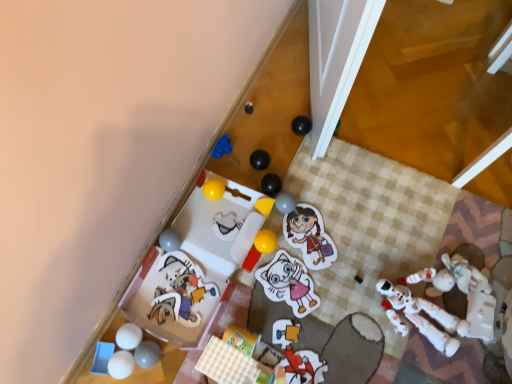
Locate an element on the screen. empty space that is ontop of cartoon cat plush at lower left, placed as the 11th toy when sorted from right to left (from a real-world perspective) is located at coordinates (179, 289).